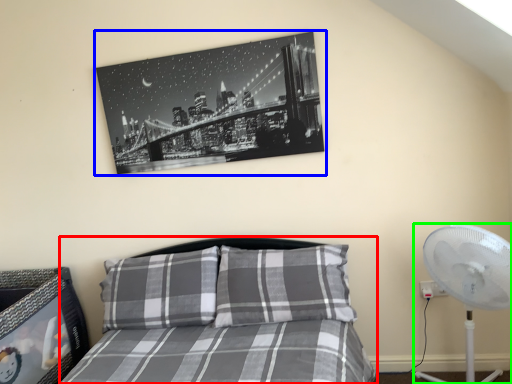
Question: Based on their relative distances, which object is farther from bed (highlighted by a red box)? Choose from picture frame (highlighted by a blue box) and mechanical fan (highlighted by a green box).

Choices:
 (A) picture frame
 (B) mechanical fan

Answer: (B)